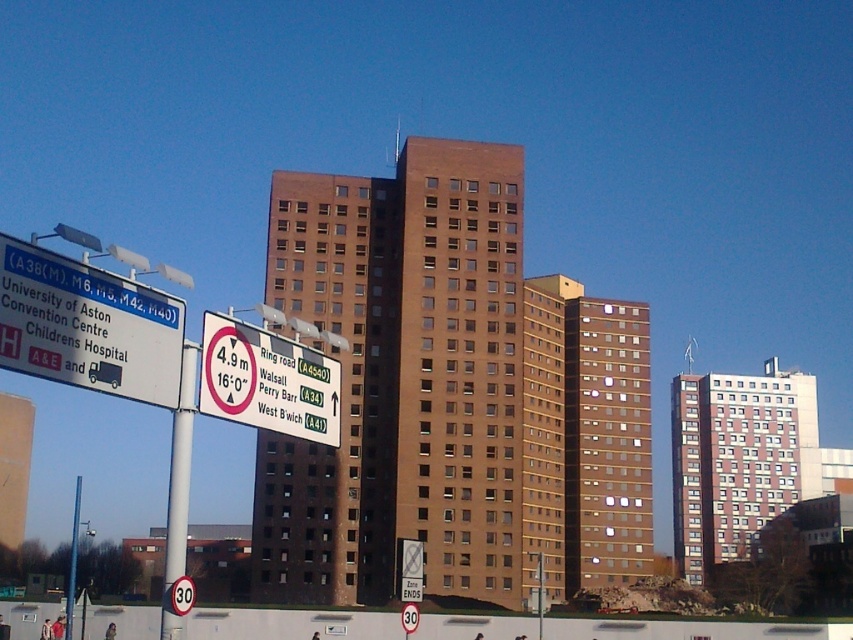
Question: Which point is farther to the camera?

Choices:
 (A) (78, 516)
 (B) (175, 449)
 (C) (296, 412)

Answer: (A)

Question: Among these objects, which one is farthest from the camera?

Choices:
 (A) white plastic pole at left
 (B) white plastic sign at upper center

Answer: (B)

Question: In this image, where is white plastic sign at upper center located relative to metallic pole at left?

Choices:
 (A) below
 (B) above

Answer: (B)

Question: Can you confirm if white plastic sign at upper center is positioned above white plastic pole at left?

Choices:
 (A) yes
 (B) no

Answer: (A)

Question: Can you confirm if white plastic sign at upper center is smaller than metallic pole at left?

Choices:
 (A) yes
 (B) no

Answer: (A)

Question: Which of the following is the closest to the observer?

Choices:
 (A) (221, 316)
 (B) (74, 502)

Answer: (A)